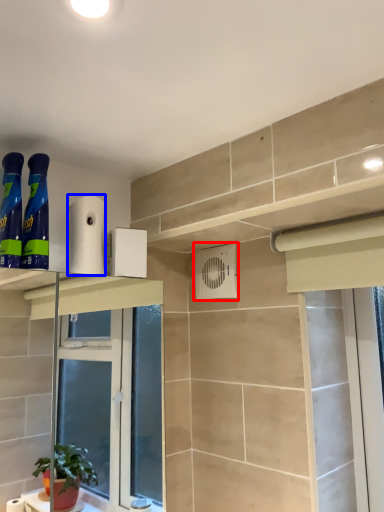
Question: Which point is closer to the camera, air conditioning (highlighted by a red box) or toilet paper (highlighted by a blue box)?

Choices:
 (A) air conditioning
 (B) toilet paper

Answer: (B)